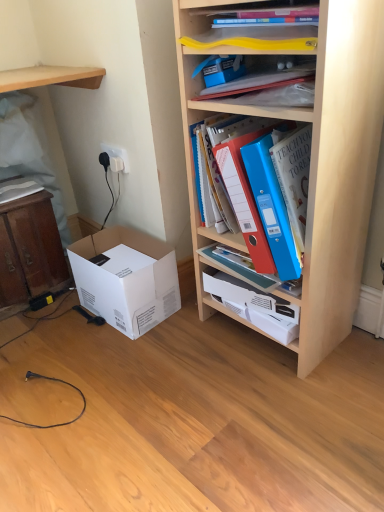
Question: Does blue plastic binder at upper center, the third book in the left-to-right sequence, have a greater height compared to wooden shelf at upper left, positioned as the 1th shelf in left-to-right order?

Choices:
 (A) yes
 (B) no

Answer: (A)

Question: Is blue plastic binder at upper center, the third book in the left-to-right sequence, located outside wooden shelf at upper left, arranged as the 2th shelf when viewed from the right?

Choices:
 (A) yes
 (B) no

Answer: (A)

Question: Does blue plastic binder at upper center, the third book in the left-to-right sequence, lie behind wooden shelf at upper left, arranged as the 2th shelf when viewed from the right?

Choices:
 (A) yes
 (B) no

Answer: (B)

Question: From a real-world perspective, is blue plastic binder at upper center, which is counted as the 1th book, starting from the right, located beneath wooden shelf at upper left, arranged as the 2th shelf when viewed from the right?

Choices:
 (A) no
 (B) yes

Answer: (B)

Question: From a real-world perspective, is blue plastic binder at upper center, which is counted as the 1th book, starting from the right, on wooden shelf at upper left, arranged as the 2th shelf when viewed from the right?

Choices:
 (A) yes
 (B) no

Answer: (B)

Question: Is wooden cabinet at left to the left or to the right of white plastic electric outlet at upper left in the image?

Choices:
 (A) right
 (B) left

Answer: (B)

Question: In the image, is wooden cabinet at left positioned in front of or behind white plastic electric outlet at upper left?

Choices:
 (A) front
 (B) behind

Answer: (A)

Question: From a real-world perspective, is wooden cabinet at left physically located above or below white plastic electric outlet at upper left?

Choices:
 (A) below
 (B) above

Answer: (A)

Question: From the image's perspective, relative to white plastic electric outlet at upper left, is wooden cabinet at left above or below?

Choices:
 (A) below
 (B) above

Answer: (A)

Question: Looking at their shapes, would you say wooden shelf at upper left, positioned as the 1th shelf in left-to-right order, is wider or thinner than wooden cabinet at left?

Choices:
 (A) thin
 (B) wide

Answer: (B)

Question: Looking at the image, does wooden shelf at upper left, arranged as the 2th shelf when viewed from the right, seem bigger or smaller compared to wooden cabinet at left?

Choices:
 (A) big
 (B) small

Answer: (B)

Question: Is wooden shelf at upper left, arranged as the 2th shelf when viewed from the right, in front of or behind wooden cabinet at left in the image?

Choices:
 (A) front
 (B) behind

Answer: (A)

Question: Choose the correct answer: Is wooden shelf at upper left, positioned as the 1th shelf in left-to-right order, inside wooden cabinet at left or outside it?

Choices:
 (A) outside
 (B) inside

Answer: (A)

Question: From a real-world perspective, is blue plastic binder at upper center, which is counted as the 1th book, starting from the right, above or below white plastic electric outlet at upper left?

Choices:
 (A) below
 (B) above

Answer: (B)

Question: Visually, is blue plastic binder at upper center, which is counted as the 1th book, starting from the right, positioned to the left or to the right of white plastic electric outlet at upper left?

Choices:
 (A) left
 (B) right

Answer: (B)